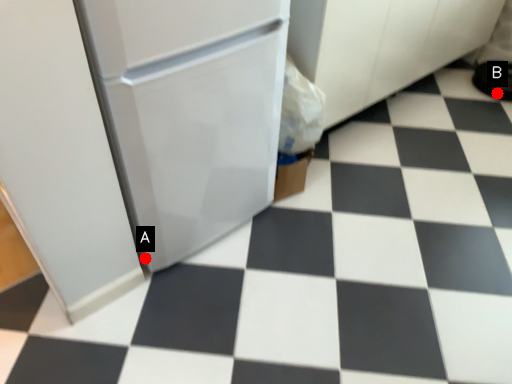
Question: Two points are circled on the image, labeled by A and B beside each circle. Which of the following is the farthest from the observer?

Choices:
 (A) A is further
 (B) B is further

Answer: (B)